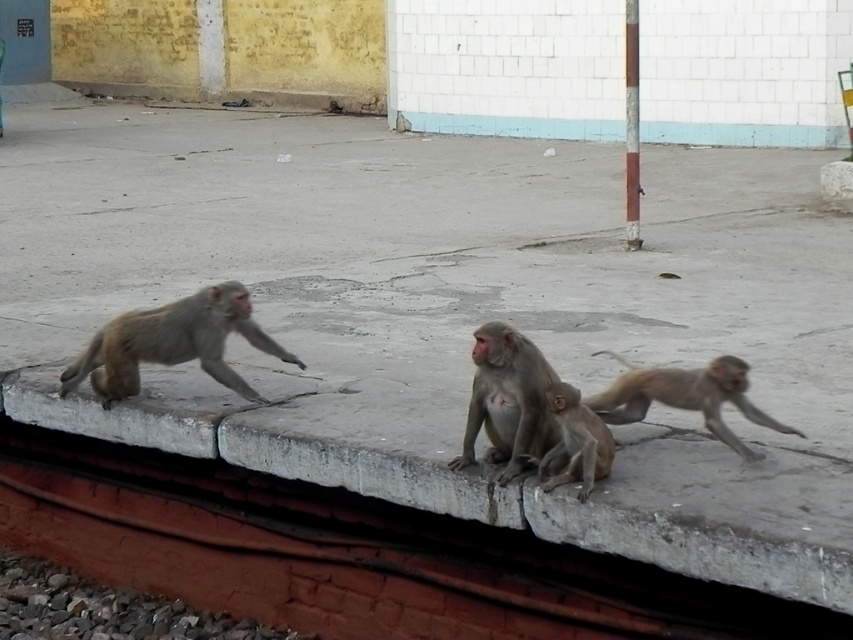
Question: Among these points, which one is farthest from the camera?

Choices:
 (A) (431, 497)
 (B) (634, 196)

Answer: (B)

Question: Can you confirm if light brown fur monkey at center is positioned below brown fur monkey at center?

Choices:
 (A) yes
 (B) no

Answer: (B)

Question: Is gray concrete ledge at center to the left of light brown fur monkey at center from the viewer's perspective?

Choices:
 (A) yes
 (B) no

Answer: (A)

Question: Where is light brown fur monkey at left located in relation to smooth concrete pole at upper right in the image?

Choices:
 (A) below
 (B) above

Answer: (A)

Question: Which of the following is the farthest from the observer?

Choices:
 (A) (563, 390)
 (B) (508, 422)

Answer: (B)

Question: Which is nearer to the gray concrete ledge at center?

Choices:
 (A) smooth concrete pole at upper right
 (B) light brown fur monkey at left

Answer: (B)